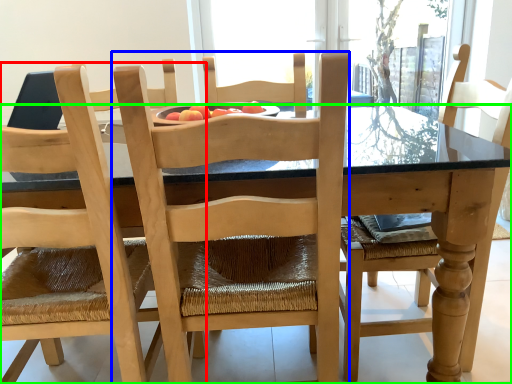
Question: Based on their relative distances, which object is farther from chair (highlighted by a red box)? Choose from chair (highlighted by a blue box) and kitchen & dining room table (highlighted by a green box).

Choices:
 (A) chair
 (B) kitchen & dining room table

Answer: (B)